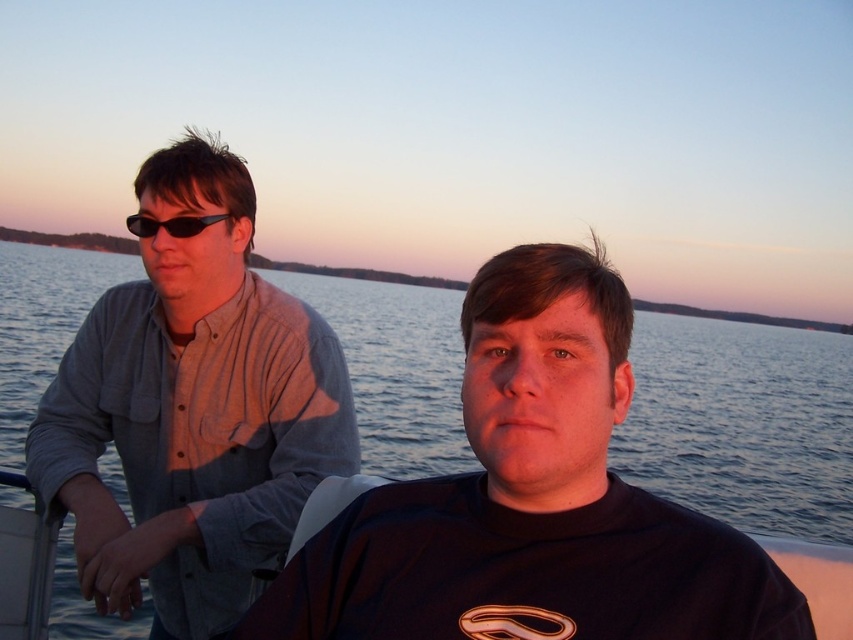
Measure the distance between black matte shirt at center and black plastic sunglasses at upper left.

Answer: They are 1.48 meters apart.

Between black matte shirt at center and black plastic sunglasses at upper left, which one appears on the left side from the viewer's perspective?

From the viewer's perspective, black plastic sunglasses at upper left appears more on the left side.

Is point (460, 596) in front of point (189, 225)?

Yes, point (460, 596) is closer to viewer.

The height and width of the screenshot is (640, 853). What are the coordinates of `black matte shirt at center` in the screenshot? It's located at (532, 500).

What do you see at coordinates (24, 573) in the screenshot? The image size is (853, 640). I see `black fabric boat at lower center` at bounding box center [24, 573].

Is black fabric boat at lower center smaller than black plastic sunglasses at upper left?

Incorrect, black fabric boat at lower center is not smaller in size than black plastic sunglasses at upper left.

Find the location of a particular element. This screenshot has height=640, width=853. black fabric boat at lower center is located at coordinates (24, 573).

Does matte gray shirt at left have a lesser height compared to black fabric boat at lower center?

No, matte gray shirt at left is not shorter than black fabric boat at lower center.

Between matte gray shirt at left and black fabric boat at lower center, which one has less height?

black fabric boat at lower center

Which is behind, point (187, 394) or point (45, 580)?

The point (45, 580) is behind.

I want to click on matte gray shirt at left, so click(x=190, y=410).